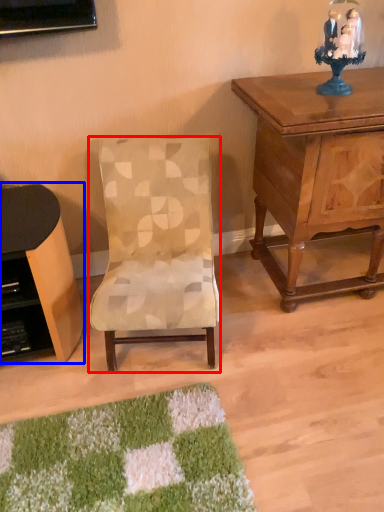
Question: Among these objects, which one is farthest to the camera, chair (highlighted by a red box) or desk (highlighted by a blue box)?

Choices:
 (A) chair
 (B) desk

Answer: (B)